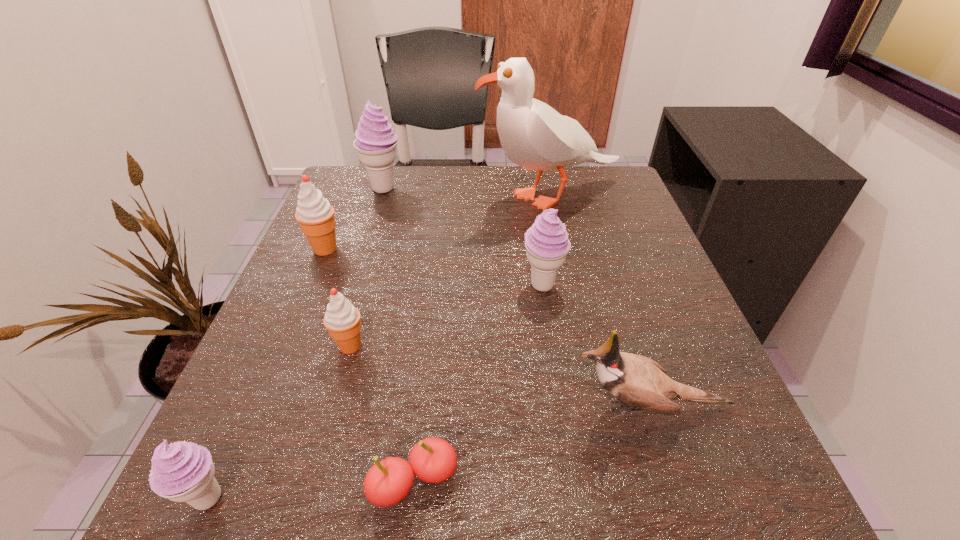
In the image, there is a desktop. At what (x,y) coordinates should I click in order to perform the action: click on free region at the far right corner. Please return your answer as a coordinate pair (x, y). Image resolution: width=960 pixels, height=540 pixels. Looking at the image, I should click on (595, 170).

At what (x,y) coordinates should I click in order to perform the action: click on empty space between the fourth nearest icecream and the farthest purple icecream. Please return your answer as a coordinate pair (x, y). The image size is (960, 540). Looking at the image, I should click on (354, 219).

Identify the location of vacant area between the nearest purple icecream and the seventh shortest object. (297, 343).

Where is `empty space between the second purple icecream from left to right and the red cherry`? The image size is (960, 540). empty space between the second purple icecream from left to right and the red cherry is located at coordinates (398, 335).

Image resolution: width=960 pixels, height=540 pixels. Find the location of `blank region between the second tallest object and the gull`. blank region between the second tallest object and the gull is located at coordinates (467, 193).

This screenshot has height=540, width=960. I want to click on free spot between the gull and the tallest icecream, so click(467, 193).

Identify the location of free space between the left red icecream and the biggest purple icecream. The width and height of the screenshot is (960, 540). (354, 219).

I want to click on free space between the gull and the smallest purple icecream, so click(379, 348).

You are a GUI agent. You are given a task and a screenshot of the screen. Output one action in this format:
    pyautogui.click(x=<x>, y=<y>)
    Task: Click on the vacant region between the bird and the rightmost icecream
    This screenshot has height=540, width=960.
    Given the screenshot: What is the action you would take?
    pyautogui.click(x=596, y=346)

Image resolution: width=960 pixels, height=540 pixels. Identify the location of vacant space that's between the seventh shortest object and the second farthest purple icecream. (463, 237).